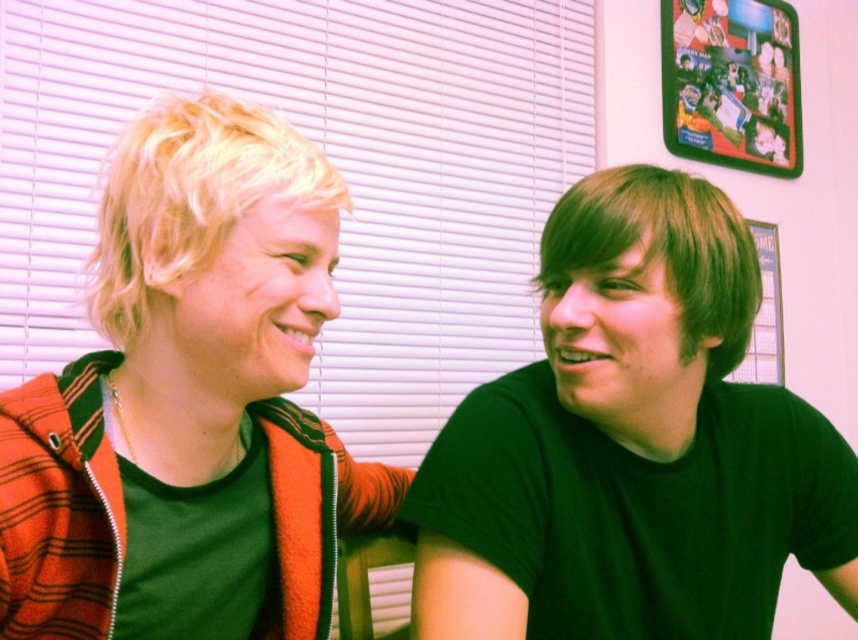
Is matte orange hoodie at left taller than green matte shirt at right?

Yes, matte orange hoodie at left is taller than green matte shirt at right.

Is matte orange hoodie at left above green matte shirt at right?

Yes, matte orange hoodie at left is above green matte shirt at right.

Identify the location of matte orange hoodie at left. (190, 403).